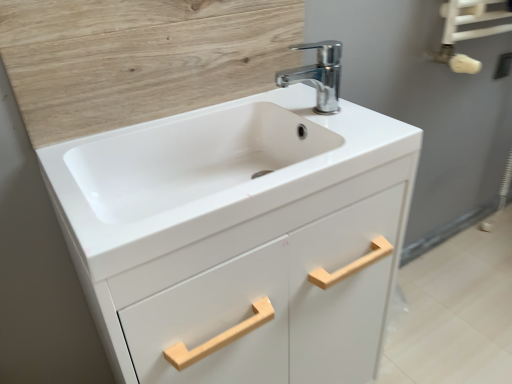
You are a GUI agent. You are given a task and a screenshot of the screen. Output one action in this format:
    pyautogui.click(x=<x>, y=<y>)
    Task: Click on the unoccupied area behind chrome metallic faucet at upper center
    
    Given the screenshot: What is the action you would take?
    pyautogui.click(x=290, y=93)